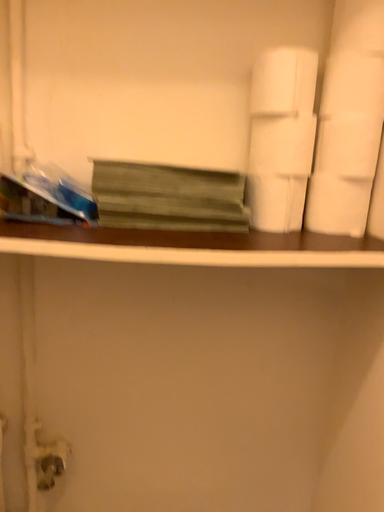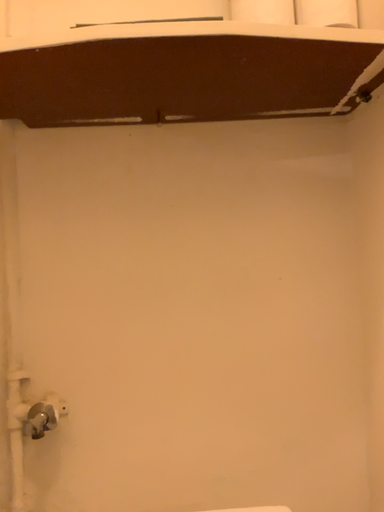
Question: How did the camera likely rotate when shooting the video?

Choices:
 (A) rotated downward
 (B) rotated upward

Answer: (B)